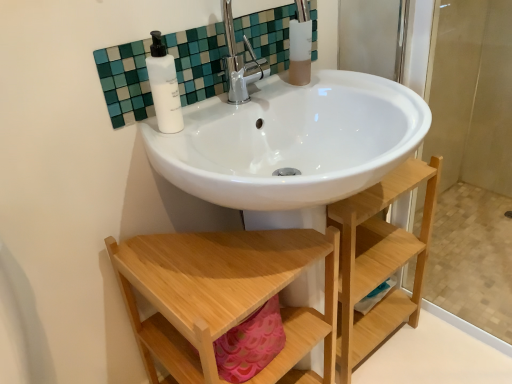
Where is `spots to the right of white matte bottle at upper center`? spots to the right of white matte bottle at upper center is located at coordinates (233, 113).